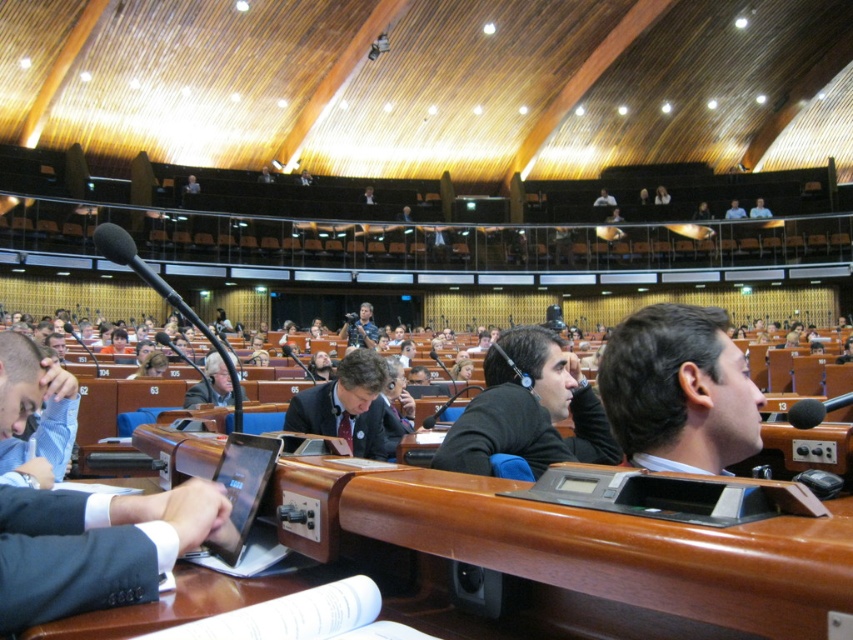
Question: Considering the real-world distances, which object is closest to the matte black camera at center?

Choices:
 (A) dark suit at center
 (B) gray fabric jacket at center
 (C) light blue shirt at upper right
 (D) light blue shirt at upper center

Answer: (B)

Question: Can you confirm if dark brown hair at center is positioned below black matte suit at center?

Choices:
 (A) yes
 (B) no

Answer: (B)

Question: Is black matte suit at center thinner than light blue shirt at upper right?

Choices:
 (A) yes
 (B) no

Answer: (A)

Question: Is gray fabric jacket at center thinner than light blue shirt at upper center?

Choices:
 (A) no
 (B) yes

Answer: (B)

Question: Which object appears closest to the camera in this image?

Choices:
 (A) gray fabric jacket at center
 (B) light blue shirt at upper right
 (C) matte black camera at center
 (D) dark brown hair at center

Answer: (D)

Question: Which object is positioned farthest from the light blue shirt at upper right?

Choices:
 (A) dark brown hair at center
 (B) matte black camera at center
 (C) gray fabric jacket at center

Answer: (A)